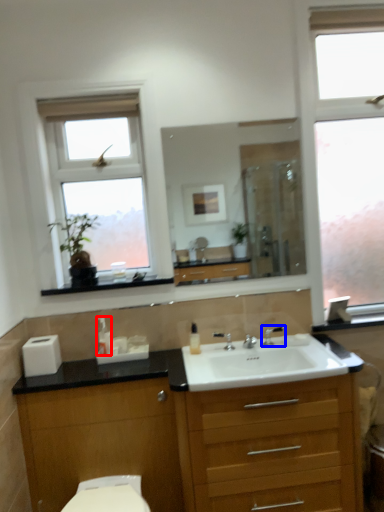
Question: Which object is further to the camera taking this photo, soap dispenser (highlighted by a red box) or tap (highlighted by a blue box)?

Choices:
 (A) soap dispenser
 (B) tap

Answer: (B)